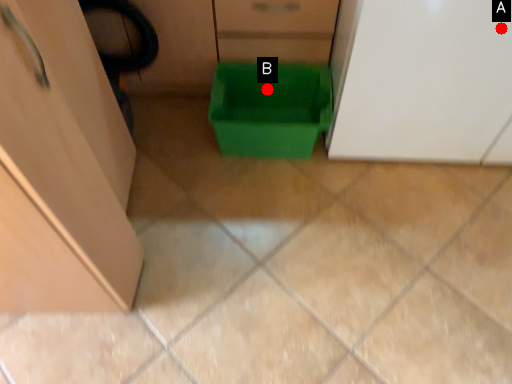
Question: Two points are circled on the image, labeled by A and B beside each circle. Which point appears farthest from the camera in this image?

Choices:
 (A) A is further
 (B) B is further

Answer: (B)